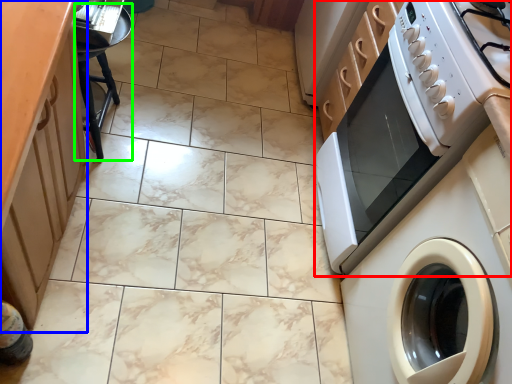
Question: Considering the real-world distances, which object is closest to home appliance (highlighted by a red box)? cabinetry (highlighted by a blue box) or stool (highlighted by a green box).

Choices:
 (A) cabinetry
 (B) stool

Answer: (A)